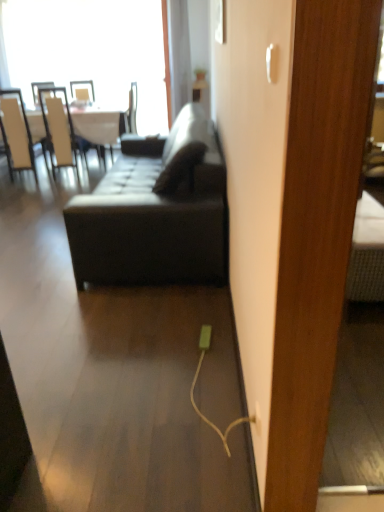
Question: Considering the relative sizes of white glossy table at upper left and matte black couch at center in the image provided, is white glossy table at upper left taller than matte black couch at center?

Choices:
 (A) yes
 (B) no

Answer: (B)

Question: Considering the relative sizes of white glossy table at upper left and matte black couch at center in the image provided, is white glossy table at upper left smaller than matte black couch at center?

Choices:
 (A) no
 (B) yes

Answer: (B)

Question: Is white glossy table at upper left not close to matte black couch at center?

Choices:
 (A) yes
 (B) no

Answer: (A)

Question: Is white glossy table at upper left directly adjacent to matte black couch at center?

Choices:
 (A) yes
 (B) no

Answer: (B)

Question: From a real-world perspective, is white glossy table at upper left on matte black couch at center?

Choices:
 (A) no
 (B) yes

Answer: (A)

Question: In terms of width, does transparent glass window at upper left look wider or thinner when compared to white leather chair at left, which ranks as the 2th chair in right-to-left order?

Choices:
 (A) thin
 (B) wide

Answer: (A)

Question: Is transparent glass window at upper left in front of or behind white leather chair at left, which ranks as the 2th chair in right-to-left order, in the image?

Choices:
 (A) front
 (B) behind

Answer: (B)

Question: From the image's perspective, is transparent glass window at upper left above or below white leather chair at left, which appears as the 1th chair when viewed from the left?

Choices:
 (A) above
 (B) below

Answer: (A)

Question: Would you say transparent glass window at upper left is to the left or to the right of white leather chair at left, which ranks as the 2th chair in right-to-left order, in the picture?

Choices:
 (A) left
 (B) right

Answer: (B)

Question: Looking at the image, does white plastic electric outlet at lower center seem bigger or smaller compared to white glossy table at upper left?

Choices:
 (A) small
 (B) big

Answer: (A)

Question: Would you say white plastic electric outlet at lower center is to the left or to the right of white glossy table at upper left in the picture?

Choices:
 (A) right
 (B) left

Answer: (A)

Question: Is white plastic electric outlet at lower center in front of or behind white glossy table at upper left in the image?

Choices:
 (A) front
 (B) behind

Answer: (A)

Question: From a real-world perspective, is white plastic electric outlet at lower center physically located above or below white glossy table at upper left?

Choices:
 (A) below
 (B) above

Answer: (A)

Question: In terms of width, does matte black couch at center look wider or thinner when compared to white leather chair at left, the 2th chair in the left-to-right sequence?

Choices:
 (A) thin
 (B) wide

Answer: (B)

Question: Is matte black couch at center taller or shorter than white leather chair at left, the 1th chair viewed from the right?

Choices:
 (A) short
 (B) tall

Answer: (A)